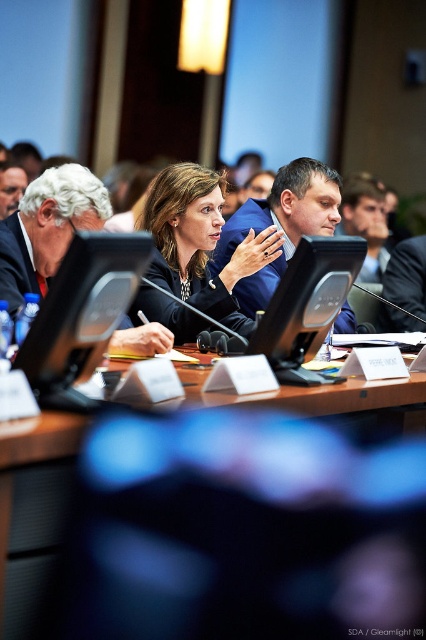
Question: Which object is positioned farthest from the white matte suit at center?

Choices:
 (A) black plastic computer at center
 (B) blue fabric suit at center
 (C) brown wooden table at center
 (D) matte black suit at center

Answer: (B)

Question: Does brown wooden table at center appear on the left side of black plastic computer at center?

Choices:
 (A) yes
 (B) no

Answer: (B)

Question: Among these objects, which one is nearest to the camera?

Choices:
 (A) white matte suit at center
 (B) matte black suit at center
 (C) brown wooden table at center
 (D) blue fabric suit at center

Answer: (C)

Question: Is brown wooden table at center thinner than black plastic computer at center?

Choices:
 (A) no
 (B) yes

Answer: (A)

Question: Which point appears farthest from the camera in this image?

Choices:
 (A) 158,634
 (B) 337,330
 (C) 195,186

Answer: (B)

Question: Does brown wooden table at center have a lesser width compared to white matte suit at center?

Choices:
 (A) no
 (B) yes

Answer: (A)